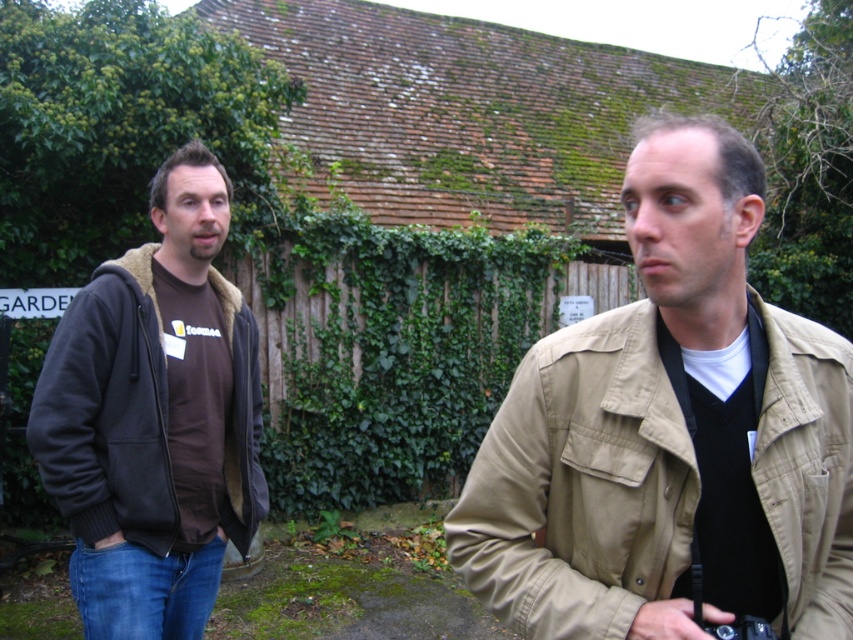
Question: Is tan/cotton jacket at right closer to the viewer compared to dark brown fleece jacket at left?

Choices:
 (A) yes
 (B) no

Answer: (A)

Question: Is tan/cotton jacket at right above dark brown fleece jacket at left?

Choices:
 (A) no
 (B) yes

Answer: (A)

Question: Which point is closer to the camera?

Choices:
 (A) (650, 308)
 (B) (229, 285)

Answer: (A)

Question: Is tan/cotton jacket at right to the right of dark brown fleece jacket at left from the viewer's perspective?

Choices:
 (A) yes
 (B) no

Answer: (A)

Question: Among these points, which one is nearest to the camera?

Choices:
 (A) (525, 436)
 (B) (97, 276)

Answer: (A)